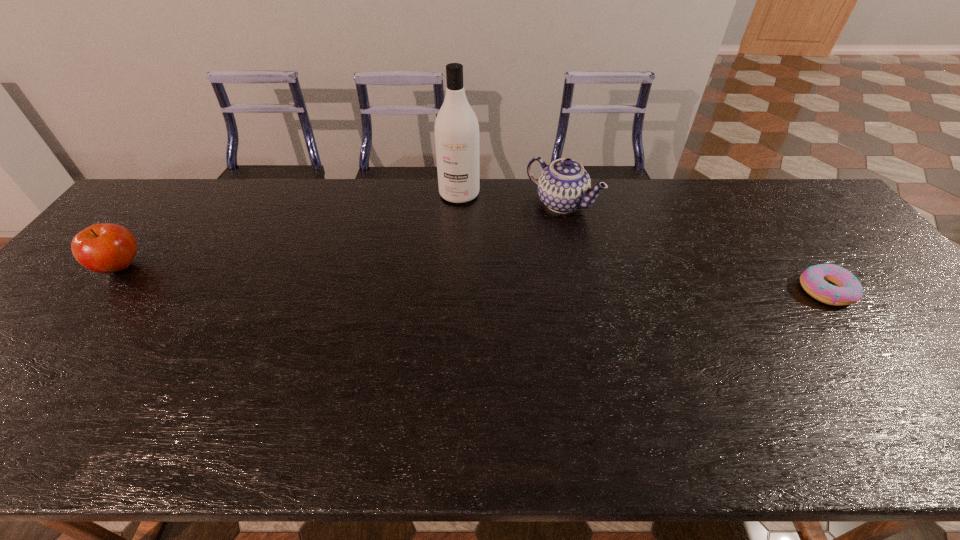
In order to click on apple in this screenshot , I will do `click(106, 248)`.

The height and width of the screenshot is (540, 960). In order to click on the leftmost object in this screenshot , I will do `click(106, 248)`.

You are a GUI agent. You are given a task and a screenshot of the screen. Output one action in this format:
    pyautogui.click(x=<x>, y=<y>)
    Task: Click on the rightmost object
    The image size is (960, 540).
    Given the screenshot: What is the action you would take?
    pyautogui.click(x=815, y=280)

Find the location of `the shortest object`. the shortest object is located at coordinates (815, 280).

The width and height of the screenshot is (960, 540). What are the coordinates of `the second object from right to left` in the screenshot? It's located at (563, 186).

Identify the location of chinaware. (563, 186).

Locate an element on the screen. This screenshot has width=960, height=540. the tallest object is located at coordinates (456, 128).

You are a GUI agent. You are given a task and a screenshot of the screen. Output one action in this format:
    pyautogui.click(x=<x>, y=<y>)
    Task: Click on the second object from left to right
    The image size is (960, 540).
    Given the screenshot: What is the action you would take?
    pyautogui.click(x=456, y=128)

The width and height of the screenshot is (960, 540). In order to click on vacant space positioned 0.180m on the back of the third tallest object in this screenshot , I will do `click(165, 212)`.

Locate an element on the screen. vacant area situated 0.330m on the back of the doughnut is located at coordinates (760, 201).